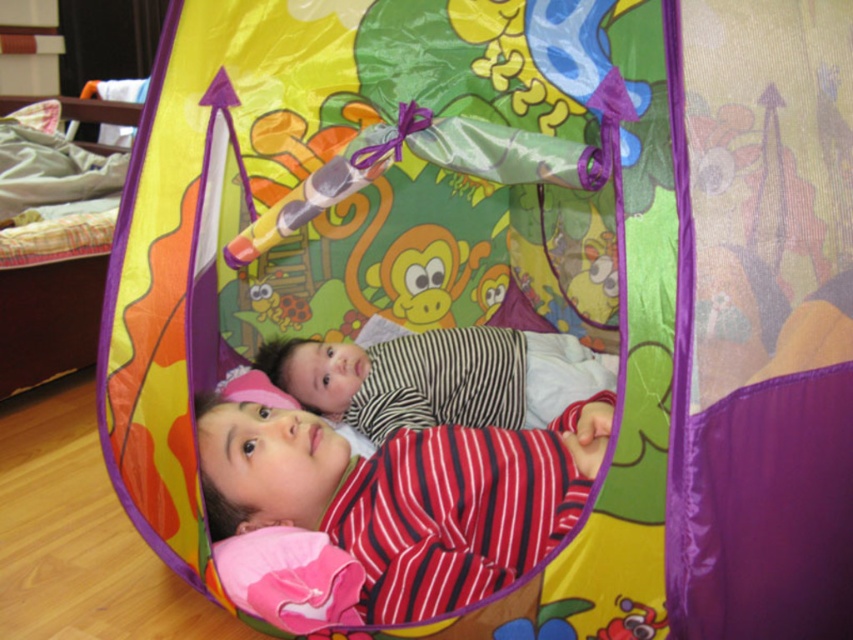
Who is lower down, striped fabric child at center or striped fabric baby at center?

striped fabric child at center is lower down.

Is striped fabric child at center wider than striped fabric baby at center?

Incorrect, striped fabric child at center's width does not surpass striped fabric baby at center's.

Which is in front, point (556, 496) or point (344, 404)?

Point (556, 496) is in front.

Identify the location of striped fabric child at center. (409, 497).